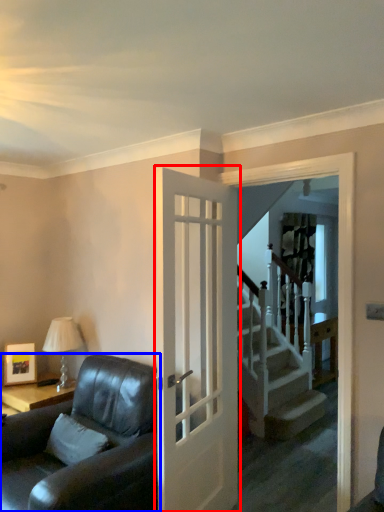
Question: Which point is further to the camera, door (highlighted by a red box) or studio couch (highlighted by a blue box)?

Choices:
 (A) door
 (B) studio couch

Answer: (A)